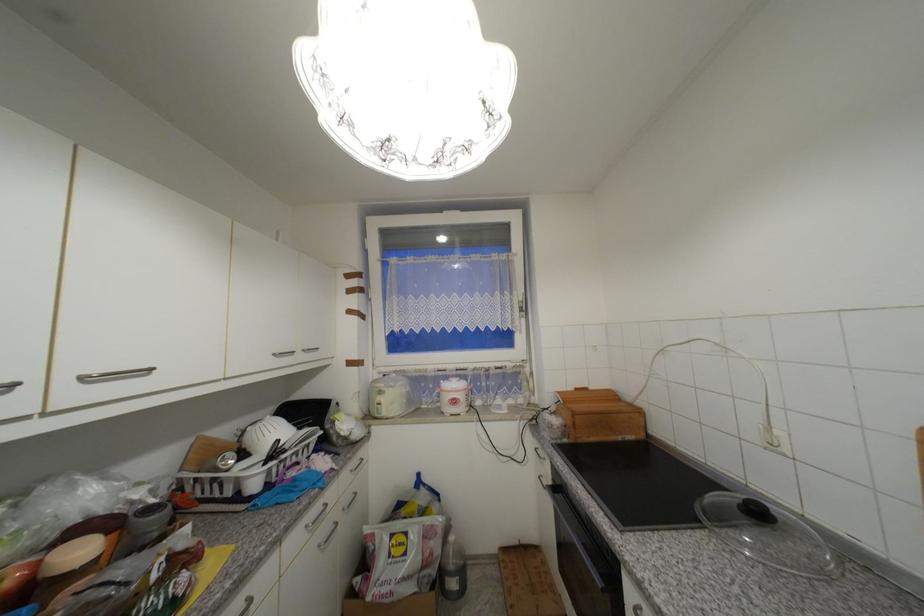
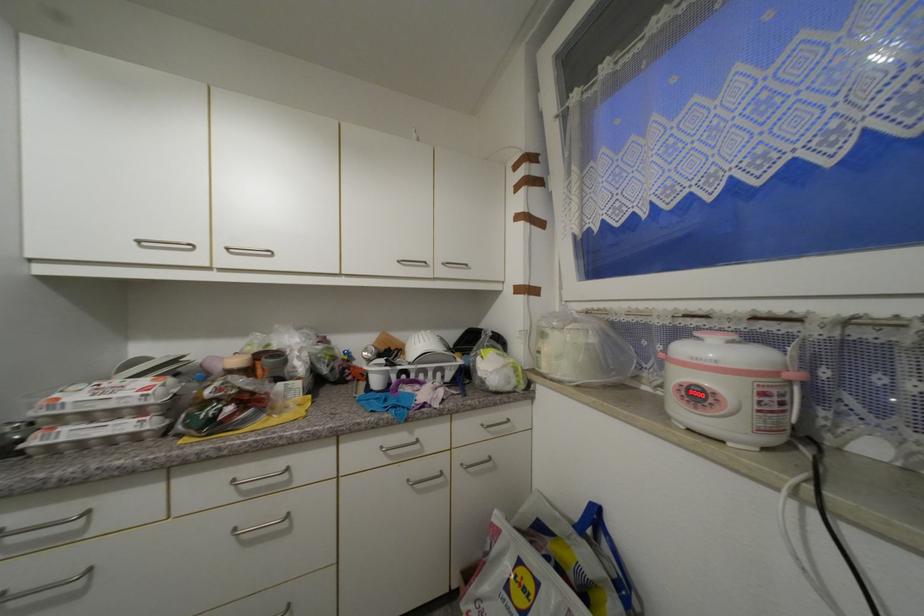
The point at (x=312, y=528) is marked in the first image. Where is the corresponding point in the second image?

(387, 448)